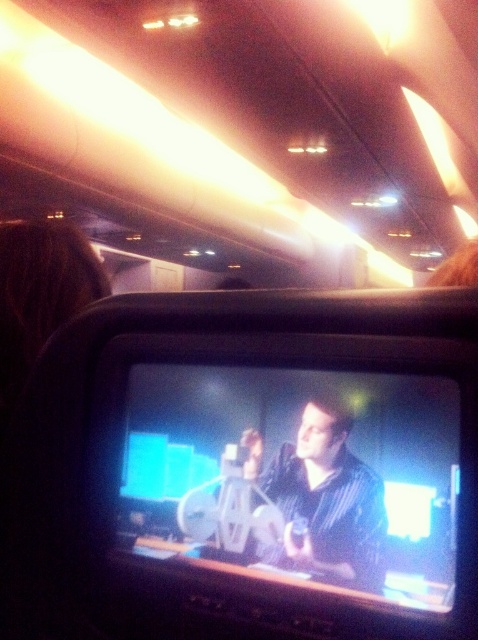
You are sitting in an airplane seat and looking at the in flight entertainment screen. There are two points marked on the screen. One is at coordinate point (295, 564) and the other is at point (361, 572). From your perspective, which point is closer to you?

Point (361, 572) is closer to you because it is in front of point (295, 564).

You are a passenger on an airplane looking at the in flight entertainment screen. You notice two objects displayed on the movie scene shown on the screen. The objects are the matte black monitor at center and the matte black shirt at center. Which object appears taller in the movie scene?

The matte black monitor at center appears taller than the matte black shirt at center in the movie scene because the matte black monitor at center has a greater height compared to matte black shirt at center.